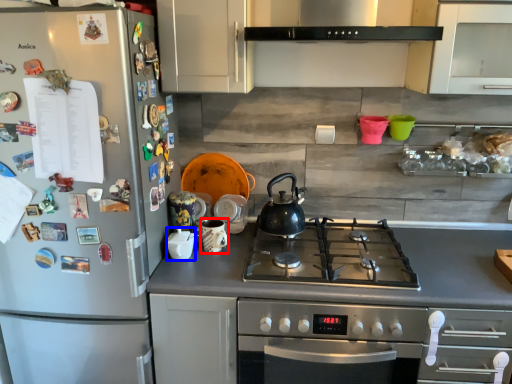
Question: Which point is further to the camera, appliance (highlighted by a red box) or appliance (highlighted by a blue box)?

Choices:
 (A) appliance
 (B) appliance

Answer: (A)